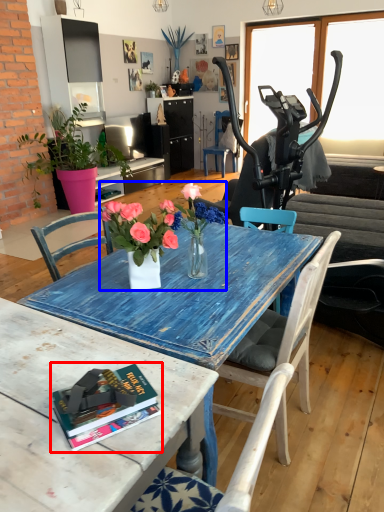
Question: Which object is closer to the camera taking this photo, book (highlighted by a red box) or floral arrangement (highlighted by a blue box)?

Choices:
 (A) book
 (B) floral arrangement

Answer: (A)